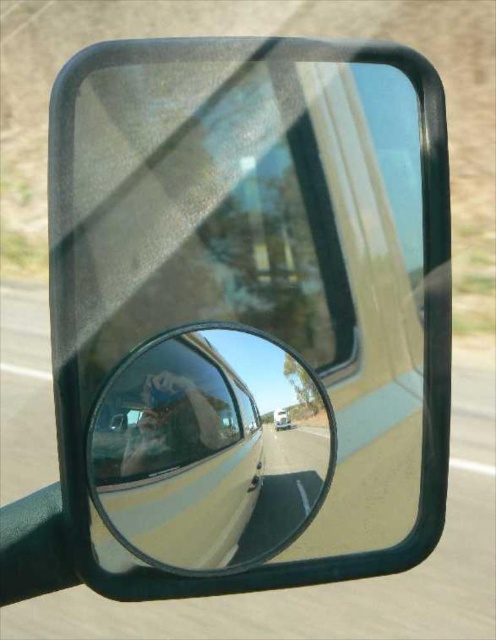
Question: Among these objects, which one is nearest to the camera?

Choices:
 (A) white glossy truck at center
 (B) matte plastic selfie at center
 (C) clear glass mirror at center

Answer: (C)

Question: Is the position of shiny metallic mirror at center more distant than that of matte plastic selfie at center?

Choices:
 (A) no
 (B) yes

Answer: (A)

Question: Based on their relative distances, which object is nearer to the shiny metallic mirror at center?

Choices:
 (A) clear glass mirror at center
 (B) matte plastic selfie at center
 (C) white glossy truck at center

Answer: (A)

Question: Which object is farther from the camera taking this photo?

Choices:
 (A) shiny metallic mirror at center
 (B) clear glass mirror at center
 (C) white glossy truck at center
 (D) matte plastic selfie at center

Answer: (C)

Question: Does shiny metallic mirror at center have a greater width compared to white glossy truck at center?

Choices:
 (A) yes
 (B) no

Answer: (A)

Question: Can you confirm if clear glass mirror at center is positioned to the left of white glossy truck at center?

Choices:
 (A) yes
 (B) no

Answer: (A)